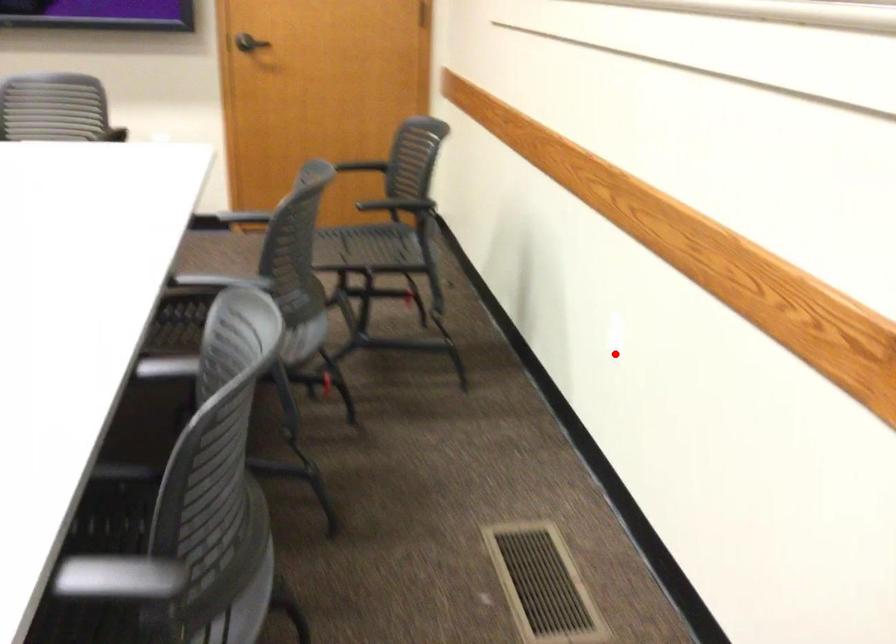
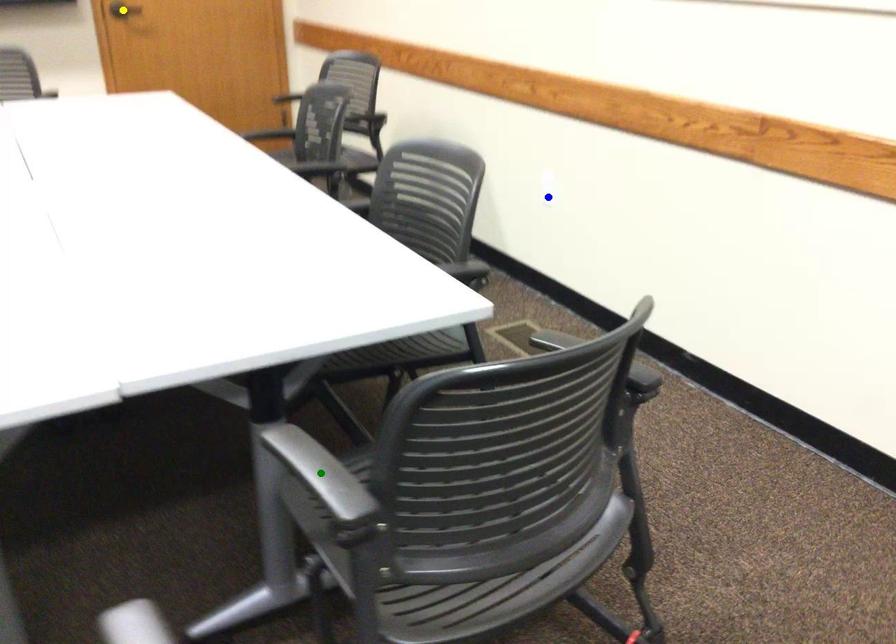
Question: I am providing you with two images of the same scene from different viewpoints. A red point is marked on the first image. You are given multiple points on the second image. Which point in image 2 represents the same 3d spot as the red point in image 1?

Choices:
 (A) yellow point
 (B) blue point
 (C) green point

Answer: (B)